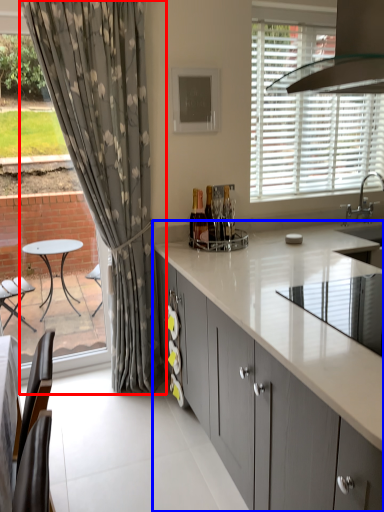
Question: Among these objects, which one is farthest to the camera, curtain (highlighted by a red box) or cabinetry (highlighted by a blue box)?

Choices:
 (A) curtain
 (B) cabinetry

Answer: (A)